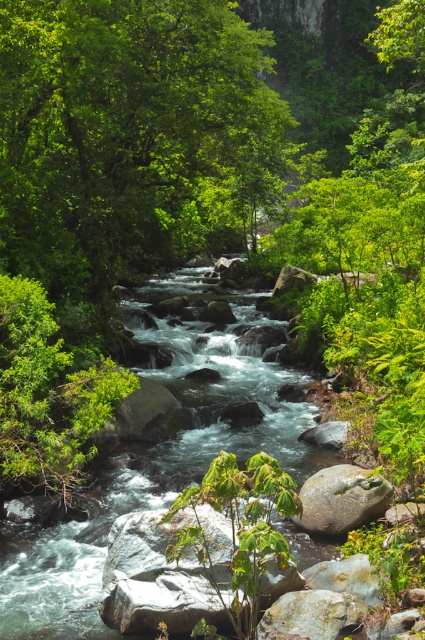
You are a hiker carrying a backpack and want to cross the river. You see the green leafy tree at left and the rusty metallic rock at center. How far apart are these two landmarks to help plan your path?

The green leafy tree at left and the rusty metallic rock at center are 3.15 meters apart.

You are standing at the point with coordinates point [360,490] and want to walk towards the point with coordinates point [65,458]. Which direction should you move?

You should move forward because point [65,458] is behind point [360,490] from your current position.